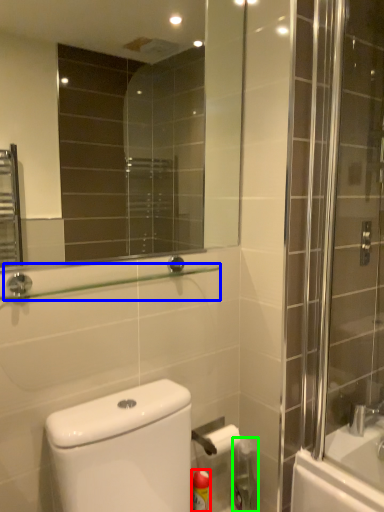
Question: Which is nearer to the cleaning product (highlighted by a red box)? balustrade (highlighted by a blue box) or cleaning product (highlighted by a green box).

Choices:
 (A) balustrade
 (B) cleaning product

Answer: (B)